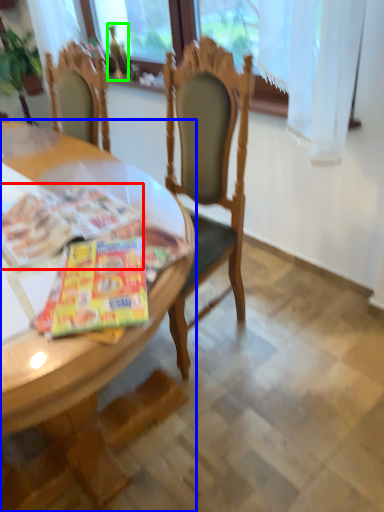
Question: Which object is the farthest from magazine (highlighted by a red box)? Choose among these: desk (highlighted by a blue box) or bottle (highlighted by a green box).

Choices:
 (A) desk
 (B) bottle

Answer: (B)